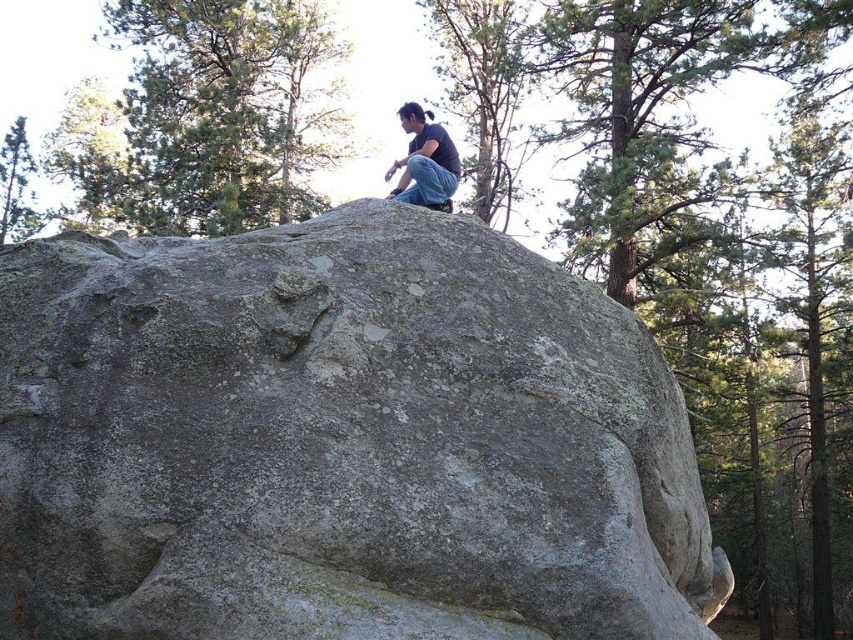
Question: Does gray rough rock at center have a greater width compared to black matte shirt at upper center?

Choices:
 (A) yes
 (B) no

Answer: (A)

Question: Considering the relative positions of green leafy tree at upper left and black matte shirt at upper center in the image provided, where is green leafy tree at upper left located with respect to black matte shirt at upper center?

Choices:
 (A) below
 (B) above

Answer: (B)

Question: Is black matte shirt at upper center closer to the viewer compared to green textured tree at upper left?

Choices:
 (A) no
 (B) yes

Answer: (B)

Question: Considering the real-world distances, which object is farthest from the green textured tree at upper left?

Choices:
 (A) green leafy tree at upper left
 (B) black matte shirt at upper center
 (C) gray rough rock at center

Answer: (C)

Question: Which point is closer to the camera?

Choices:
 (A) (399, 184)
 (B) (15, 216)
 (C) (506, 570)

Answer: (C)

Question: Which point is farther from the camera taking this photo?

Choices:
 (A) (428, 172)
 (B) (442, 532)
 (C) (99, 204)

Answer: (C)